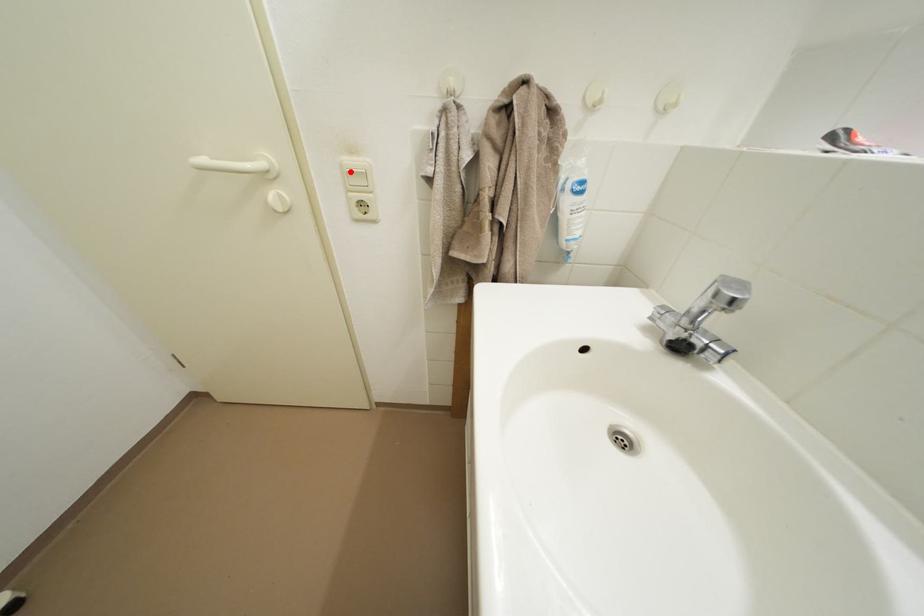
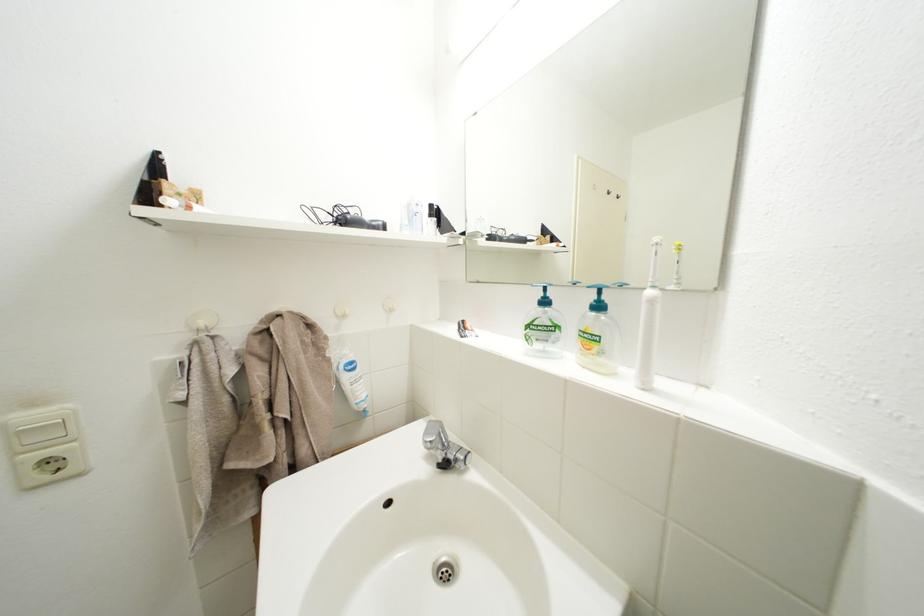
The point at the highlighted location is marked in the first image. Where is the corresponding point in the second image?

(14, 432)